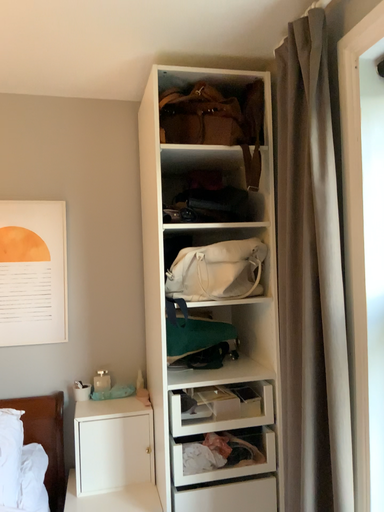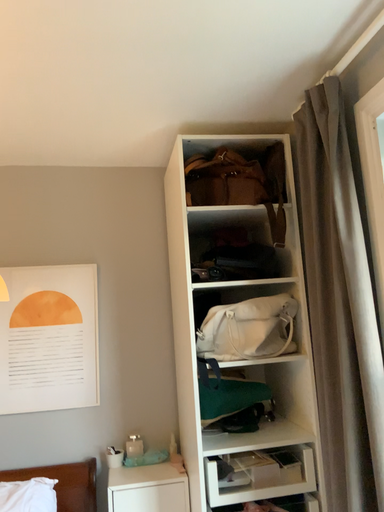
Question: How did the camera likely rotate when shooting the video?

Choices:
 (A) rotated upward
 (B) rotated downward

Answer: (A)